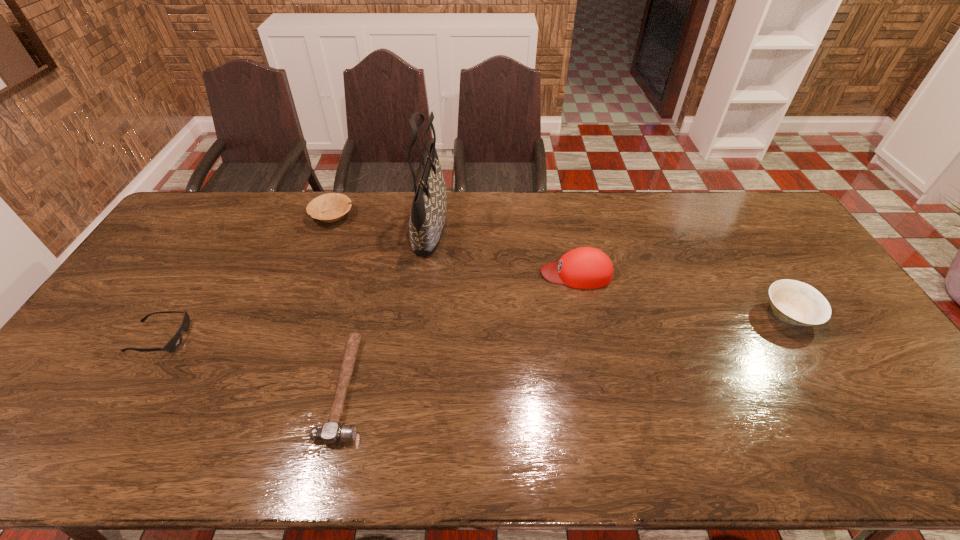
I want to click on vacant space situated 0.320m on the left of the tote bag, so point(324,226).

Where is `vacant space located on the front-facing side of the baseball cap`? The height and width of the screenshot is (540, 960). vacant space located on the front-facing side of the baseball cap is located at coordinates (416, 273).

Where is `vacant space located 0.320m on the front-facing side of the baseball cap`? vacant space located 0.320m on the front-facing side of the baseball cap is located at coordinates (439, 273).

At what (x,y) coordinates should I click in order to perform the action: click on free location located 0.390m on the front-facing side of the baseball cap. Please return your answer as a coordinate pair (x, y). The height and width of the screenshot is (540, 960). Looking at the image, I should click on (416, 273).

Identify the location of vacant space situated on the back of the rightmost object. (742, 240).

You are a GUI agent. You are given a task and a screenshot of the screen. Output one action in this format:
    pyautogui.click(x=<x>, y=<y>)
    Task: Click on the free space located 0.120m on the right of the fourth tallest object
    
    Given the screenshot: What is the action you would take?
    pyautogui.click(x=387, y=216)

The image size is (960, 540). Find the location of `vacant space situated on the front-facing side of the leftmost object`. vacant space situated on the front-facing side of the leftmost object is located at coordinates (281, 338).

This screenshot has width=960, height=540. I want to click on vacant space located on the striking face of the fourth object from right to left, so click(458, 388).

Identify the location of tote bag that is at the far edge. click(427, 219).

I want to click on bowl that is at the far edge, so click(x=334, y=206).